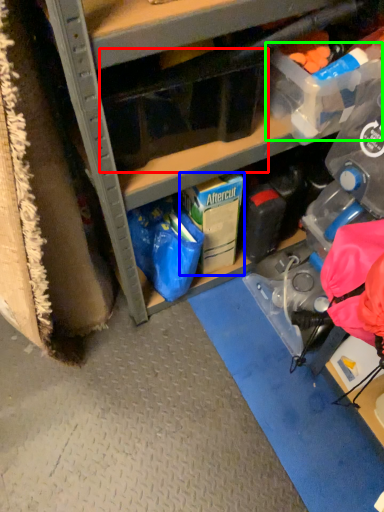
Question: Based on their relative distances, which object is nearer to storage box (highlighted by a red box)? Choose from storage box (highlighted by a blue box) and storage box (highlighted by a green box).

Choices:
 (A) storage box
 (B) storage box

Answer: (B)